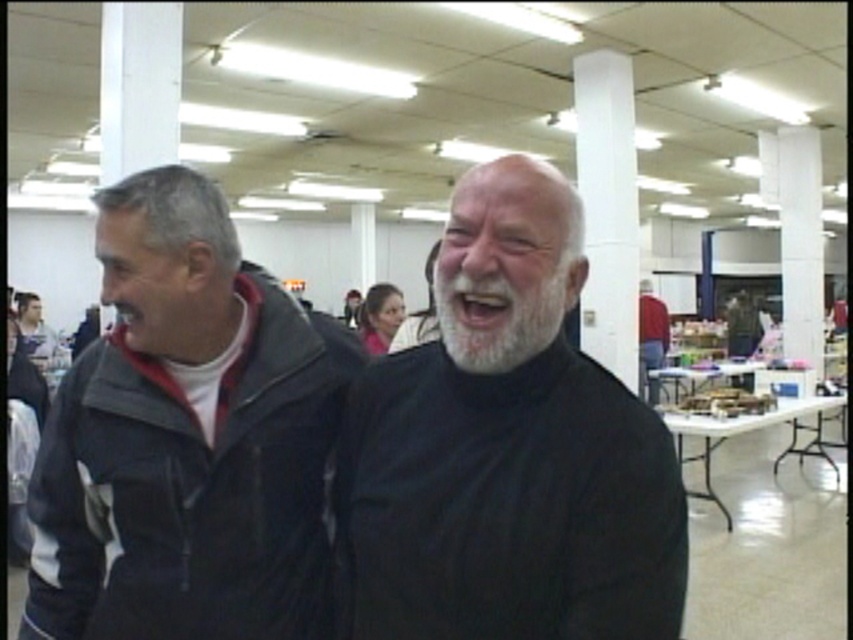
You are a photographer positioned in the hall and want to take a photo of the white matte beard at center and the red sweater at center. Which object should you focus on first to ensure both are in focus?

To ensure both the white matte beard at center and the red sweater at center are in focus, you should focus on the white matte beard at center first since it is closer to the viewer. This way, the depth of field will extend from the beard to the sweater, increasing the likelihood both are sharp.

You are standing in the hall and need to locate the white matte beard at center. According to the coordinates provided, in which direction should you move relative to your current position at point 0,0?

The white matte beard at center is located at coordinates point (x=506, y=451). Since your current position is at point (x=0, y=0), you should move northeast to reach it.

You are standing in the hall and want to greet the person with the red sweater at center. Which direction should you move to approach them from the white matte beard at center?

The white matte beard at center is to the left of the red sweater at center, so you should move to the right to approach the red sweater at center from the white matte beard at center.